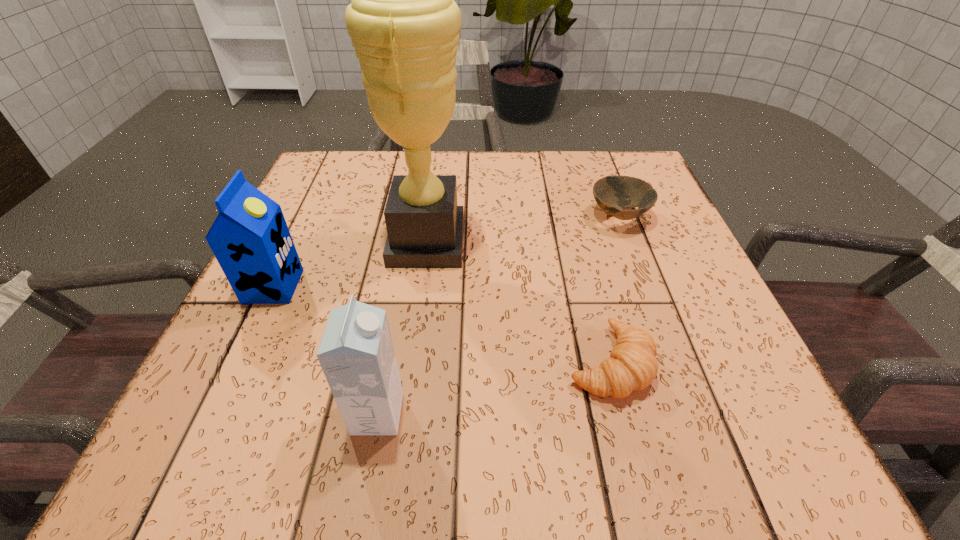
Where is `trophy cup`? Image resolution: width=960 pixels, height=540 pixels. trophy cup is located at coordinates (404, 24).

Locate an element on the screen. the leftmost object is located at coordinates (250, 239).

Locate an element on the screen. the left carton is located at coordinates (250, 239).

The width and height of the screenshot is (960, 540). What are the coordinates of `the nearer carton` in the screenshot? It's located at (356, 353).

I want to click on bowl, so click(612, 193).

In order to click on crescent roll in this screenshot , I will do `click(632, 366)`.

Where is `vacant space located at the front of the tallest object with handles`? The width and height of the screenshot is (960, 540). vacant space located at the front of the tallest object with handles is located at coordinates (499, 242).

Find the location of `free space located with the cap open on the farther carton`. free space located with the cap open on the farther carton is located at coordinates (349, 286).

Where is `vacant region located 0.070m on the front label of the right carton`? The height and width of the screenshot is (540, 960). vacant region located 0.070m on the front label of the right carton is located at coordinates (447, 414).

Locate an element on the screen. The width and height of the screenshot is (960, 540). vacant space located on the back of the bowl is located at coordinates (603, 176).